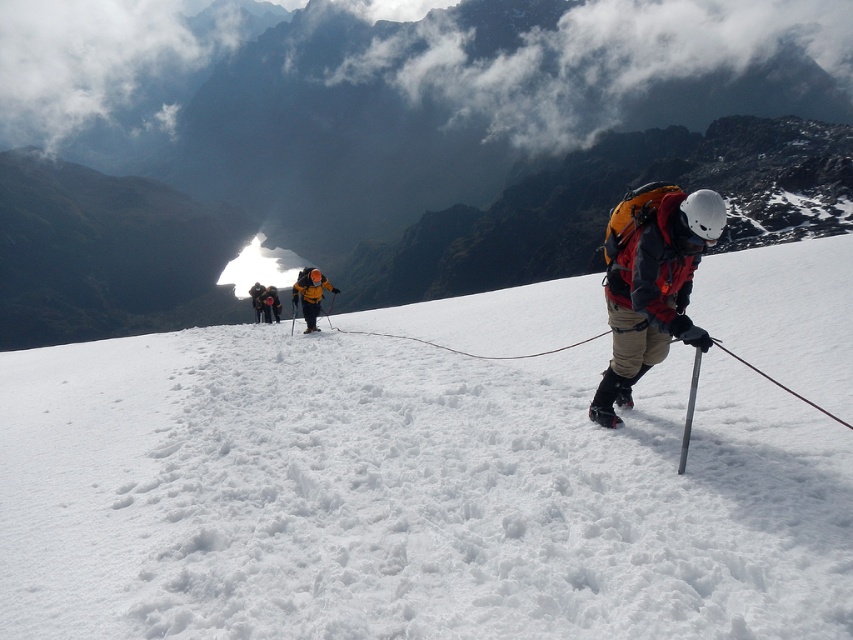
Question: Which of the following is the closest to the observer?

Choices:
 (A) white fluffy snow at center
 (B) yellow matte ski at center

Answer: (A)

Question: Does orange fabric jacket at center come behind yellow matte ski at center?

Choices:
 (A) yes
 (B) no

Answer: (A)

Question: Can you confirm if yellow fabric jacket at center is bigger than yellow matte ski at center?

Choices:
 (A) yes
 (B) no

Answer: (A)

Question: Which object is farther from the camera taking this photo?

Choices:
 (A) orange fabric jacket at center
 (B) yellow fabric jacket at center
 (C) yellow matte ski at center
 (D) white fluffy snow at center

Answer: (B)

Question: Considering the relative positions of orange fabric jacket at center and yellow fabric jacket at center in the image provided, where is orange fabric jacket at center located with respect to yellow fabric jacket at center?

Choices:
 (A) left
 (B) right

Answer: (B)

Question: Which object is the farthest from the yellow fabric jacket at center?

Choices:
 (A) orange fabric jacket at center
 (B) white fluffy snow at center

Answer: (B)